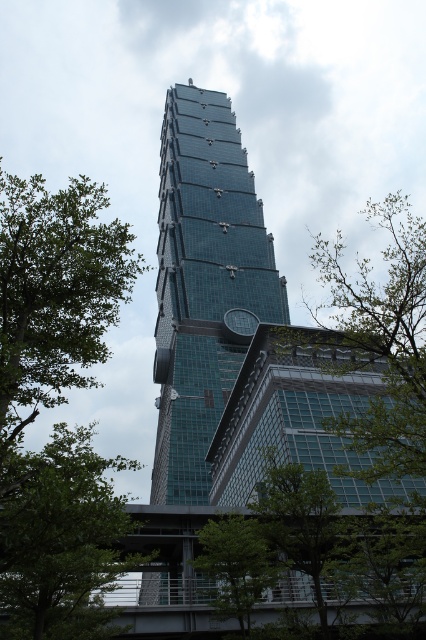
Question: Which object is positioned closest to the green leafy tree at lower right?

Choices:
 (A) green leafy tree at lower center
 (B) transparent glass tower at center
 (C) green leafy tree at left
 (D) green leafy tree at lower left

Answer: (A)

Question: Considering the real-world distances, which object is farthest from the green leafy tree at lower left?

Choices:
 (A) green leafy tree at left
 (B) green leafy tree at lower center
 (C) green leafy tree at lower right

Answer: (C)

Question: Does green leafy tree at lower left come in front of green leafy tree at lower right?

Choices:
 (A) yes
 (B) no

Answer: (A)

Question: Can you confirm if transparent glass tower at center is positioned to the left of green leafy tree at lower center?

Choices:
 (A) no
 (B) yes

Answer: (B)

Question: Among these points, which one is nearest to the camera?

Choices:
 (A) (351, 298)
 (B) (218, 218)
 (C) (270, 564)

Answer: (C)

Question: Is green leafy tree at lower left thinner than green leafy tree at lower right?

Choices:
 (A) yes
 (B) no

Answer: (A)